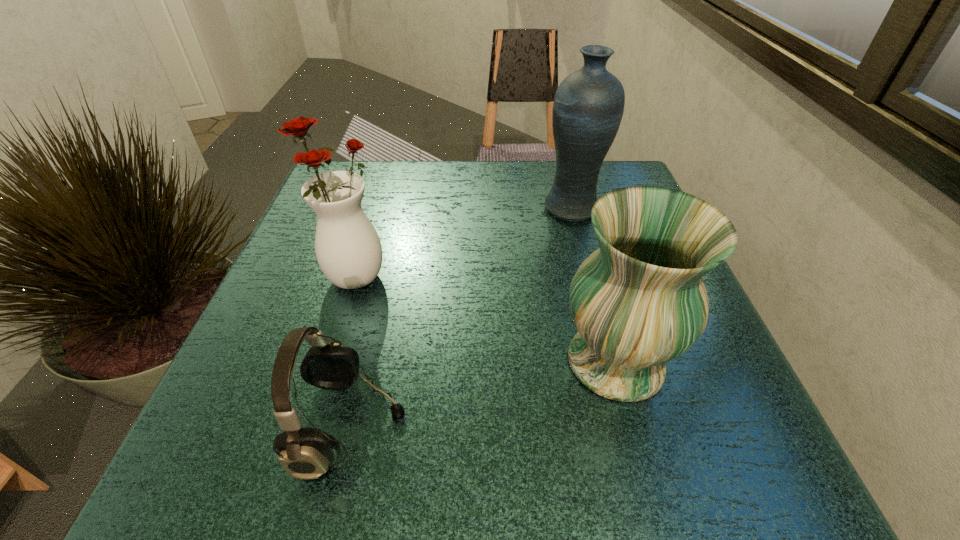
At what (x,y) coordinates should I click in order to perform the action: click on the farthest vase. Please return your answer as a coordinate pair (x, y). Looking at the image, I should click on [x=588, y=106].

This screenshot has width=960, height=540. What are the coordinates of `the second nearest vase` in the screenshot? It's located at (348, 249).

In order to click on the leftmost vase in this screenshot , I will do `click(348, 249)`.

In order to click on the nearest vase in this screenshot , I will do `click(639, 301)`.

Locate an element on the screen. headset is located at coordinates (305, 453).

Locate an element on the screen. free space located 0.400m on the front of the farthest object is located at coordinates (618, 382).

The image size is (960, 540). Identify the location of vacant space located on the right of the third nearest object. (587, 276).

This screenshot has width=960, height=540. I want to click on blank space located 0.260m on the back of the nearest vase, so click(579, 228).

Image resolution: width=960 pixels, height=540 pixels. Find the location of `free space located 0.300m with the microphone on the side of the shortest object`. free space located 0.300m with the microphone on the side of the shortest object is located at coordinates (620, 427).

Locate an element on the screen. object positioned at the far edge is located at coordinates (588, 106).